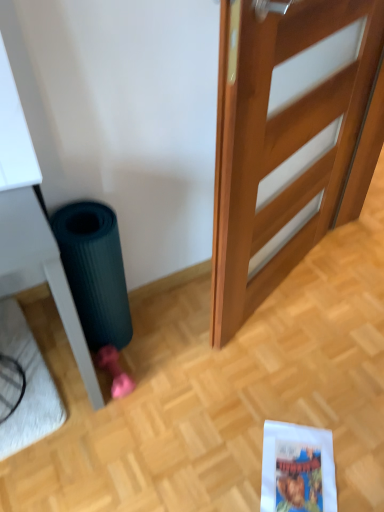
Where is `vacant area located to the right-hand side of wooden door at center`? Image resolution: width=384 pixels, height=512 pixels. vacant area located to the right-hand side of wooden door at center is located at coordinates (347, 290).